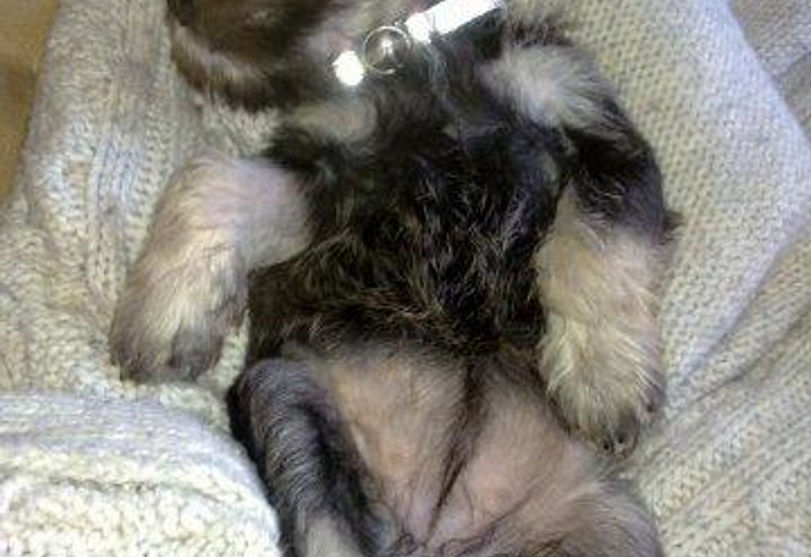
This screenshot has height=557, width=811. Identify the location of grey sheets. (736, 201).